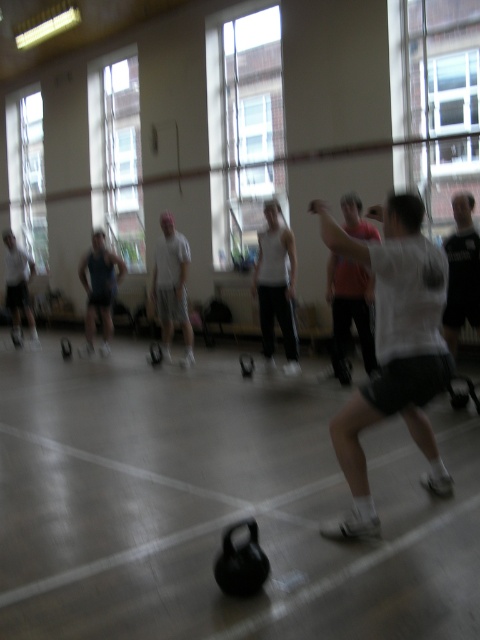
Question: Does pink fabric shirt at center have a greater width compared to gray fabric shorts at left?

Choices:
 (A) yes
 (B) no

Answer: (B)

Question: Based on their relative distances, which object is nearer to the gray fabric shorts at left?

Choices:
 (A) white matte shirt at center
 (B) matte white tank top at left
 (C) white matte tank top at center
 (D) white matte shorts at center

Answer: (A)

Question: Considering the relative positions of pink fabric shirt at center and white matte tank top at center in the image provided, where is pink fabric shirt at center located with respect to white matte tank top at center?

Choices:
 (A) right
 (B) left

Answer: (A)

Question: Which object is the closest to the white matte shirt at center?

Choices:
 (A) pink fabric shirt at center
 (B) matte white tank top at left
 (C) white matte shorts at center

Answer: (A)

Question: Does white matte shorts at center have a greater width compared to pink fabric shirt at center?

Choices:
 (A) no
 (B) yes

Answer: (B)

Question: Which point is farther from the camera taking this photo?

Choices:
 (A) (266, 268)
 (B) (367, 284)
 (C) (367, 404)

Answer: (A)